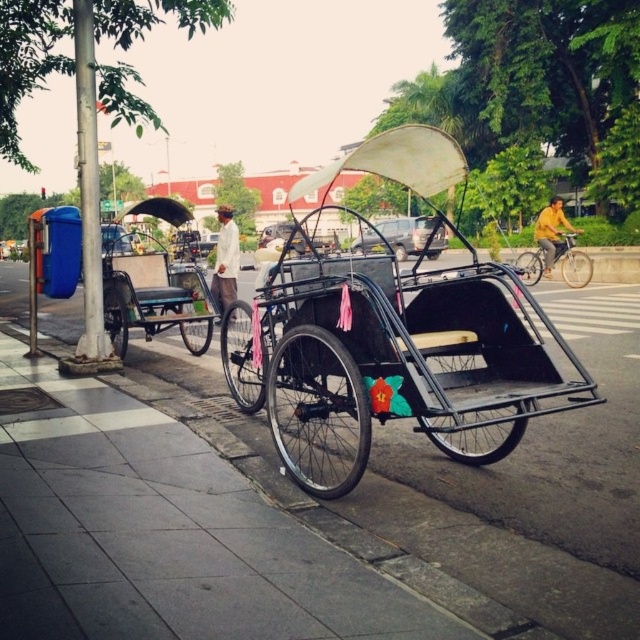
Question: Can you confirm if metallic blue rickshaw at left is positioned above yellow fabric shirt at center?

Choices:
 (A) yes
 (B) no

Answer: (B)

Question: Estimate the real-world distances between objects in this image. Which object is farther from the yellow fabric shirt at center?

Choices:
 (A) white matte shirt at center
 (B) metallic black rickshaw at center
 (C) silver metallic bicycle at center
 (D) metallic blue rickshaw at left

Answer: (D)

Question: Can you confirm if metallic blue rickshaw at left is thinner than yellow fabric shirt at center?

Choices:
 (A) no
 (B) yes

Answer: (B)

Question: Which of the following is the farthest from the observer?

Choices:
 (A) (548, 205)
 (B) (454, 324)

Answer: (A)

Question: Based on their relative distances, which object is farther from the metallic black rickshaw at center?

Choices:
 (A) silver metallic bicycle at center
 (B) yellow fabric shirt at center

Answer: (B)

Question: Does metallic blue rickshaw at left appear over yellow fabric shirt at center?

Choices:
 (A) yes
 (B) no

Answer: (B)